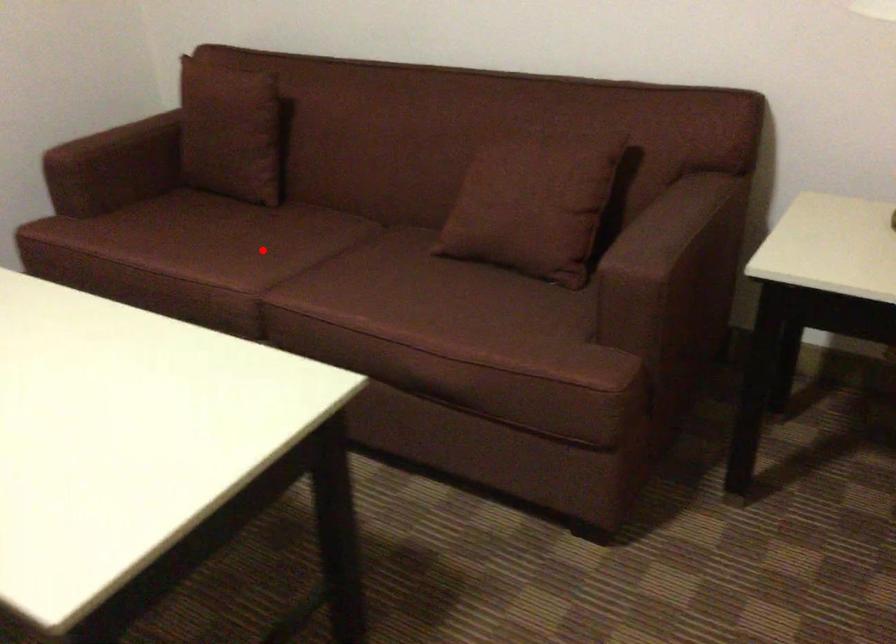
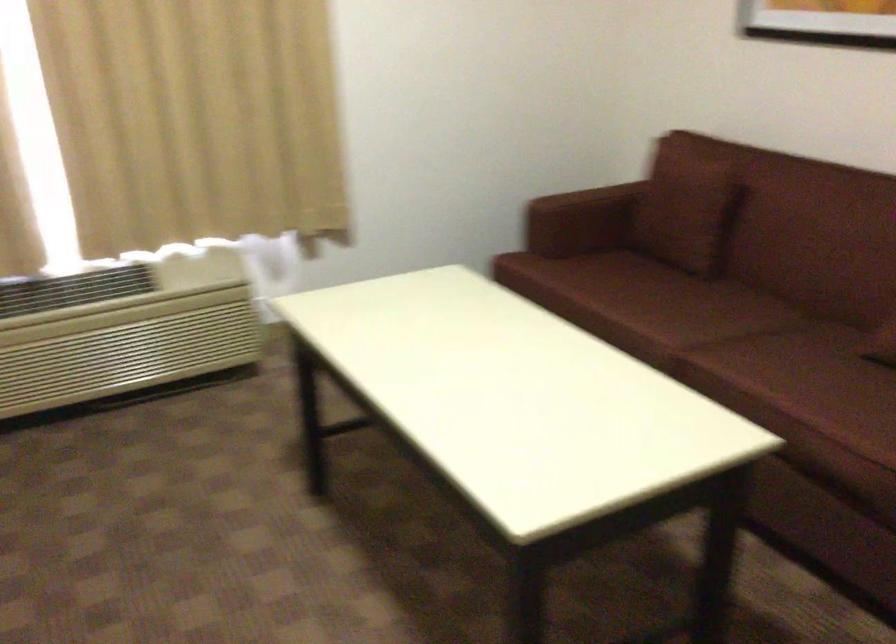
Question: I am providing you with two images of the same scene from different viewpoints. Image1 has a red point marked. In image2, the corresponding 3D location appears at what relative position? Reply with the corresponding letter.

Choices:
 (A) Closer
 (B) Farther

Answer: (B)